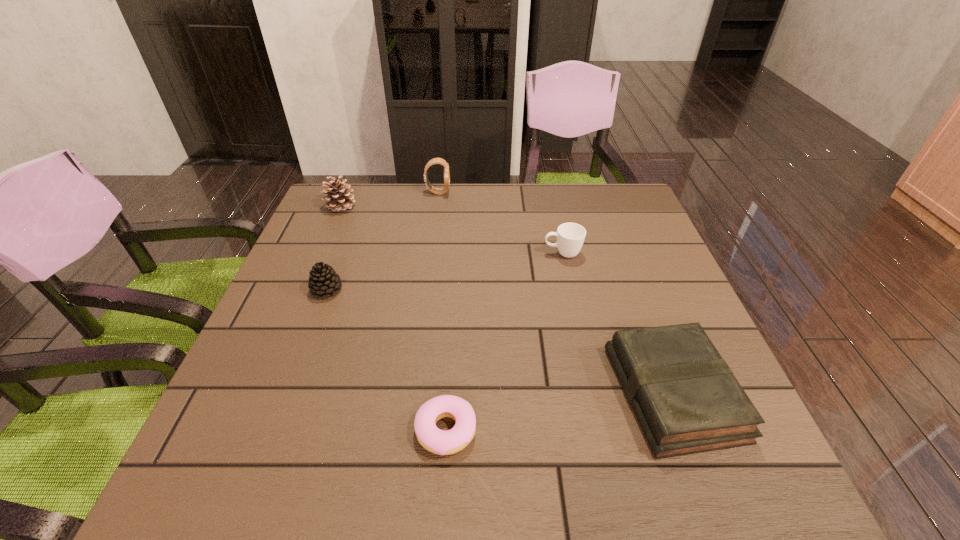
Where is `vacant region located 0.110m at the narrow end of the fourth farthest object`? This screenshot has width=960, height=540. vacant region located 0.110m at the narrow end of the fourth farthest object is located at coordinates (389, 290).

At what (x,y) coordinates should I click in order to perform the action: click on free space located 0.220m with the handle on the side of the third farthest object. Please return your answer as a coordinate pair (x, y). This screenshot has height=540, width=960. Looking at the image, I should click on (459, 253).

Find the location of a particular element. free space located with the handle on the side of the third farthest object is located at coordinates (524, 253).

In order to click on vacant region located 0.260m with the handle on the side of the third farthest object in this screenshot , I will do `click(444, 253)`.

This screenshot has height=540, width=960. In order to click on vacant region located 0.390m on the left of the book in this screenshot , I will do `click(409, 393)`.

At what (x,y) coordinates should I click in order to perform the action: click on vacant region located 0.280m on the back of the shortest object. Please return your answer as a coordinate pair (x, y). This screenshot has width=960, height=540. Looking at the image, I should click on (454, 298).

You are a GUI agent. You are given a task and a screenshot of the screen. Output one action in this format:
    pyautogui.click(x=<x>, y=<y>)
    Task: Click on the watch that is at the far edge
    
    Given the screenshot: What is the action you would take?
    pyautogui.click(x=441, y=161)

At what (x,y) coordinates should I click in order to perform the action: click on pinecone that is at the far edge. Please return your answer as a coordinate pair (x, y). This screenshot has height=540, width=960. Looking at the image, I should click on (338, 192).

The image size is (960, 540). I want to click on book located at the near edge, so click(686, 399).

The width and height of the screenshot is (960, 540). What are the coordinates of `doughnut that is at the near edge` in the screenshot? It's located at (437, 441).